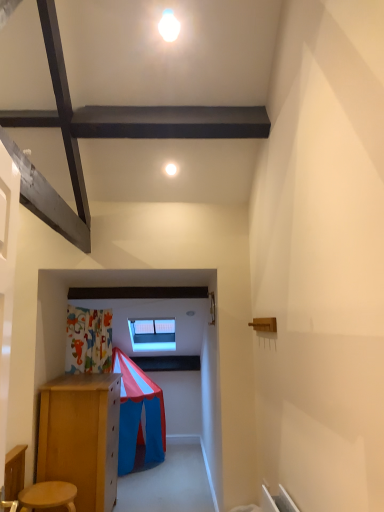
Question: From the image's perspective, is transparent glass window at center located above wooden stool at lower left?

Choices:
 (A) no
 (B) yes

Answer: (B)

Question: From a real-world perspective, is transparent glass window at center over wooden stool at lower left?

Choices:
 (A) yes
 (B) no

Answer: (A)

Question: Is transparent glass window at center surrounding wooden stool at lower left?

Choices:
 (A) yes
 (B) no

Answer: (B)

Question: Is transparent glass window at center positioned before wooden stool at lower left?

Choices:
 (A) yes
 (B) no

Answer: (B)

Question: Does transparent glass window at center appear on the right side of wooden stool at lower left?

Choices:
 (A) no
 (B) yes

Answer: (B)

Question: From their relative heights in the image, would you say wooden stool at lower left is taller or shorter than white glossy light at upper center?

Choices:
 (A) short
 (B) tall

Answer: (B)

Question: Is wooden stool at lower left in front of or behind white glossy light at upper center in the image?

Choices:
 (A) behind
 (B) front

Answer: (B)

Question: Is wooden stool at lower left inside or outside of white glossy light at upper center?

Choices:
 (A) outside
 (B) inside

Answer: (A)

Question: Is point (57, 486) positioned closer to the camera than point (173, 168)?

Choices:
 (A) farther
 (B) closer

Answer: (B)

Question: Considering the positions of white glossy light at upper center and wooden stool at lower left in the image, is white glossy light at upper center taller or shorter than wooden stool at lower left?

Choices:
 (A) tall
 (B) short

Answer: (B)

Question: In the image, is white glossy light at upper center on the left side or the right side of wooden stool at lower left?

Choices:
 (A) left
 (B) right

Answer: (B)

Question: Looking at the image, does white glossy light at upper center seem bigger or smaller compared to wooden stool at lower left?

Choices:
 (A) small
 (B) big

Answer: (A)

Question: Is white glossy light at upper center inside the boundaries of wooden stool at lower left, or outside?

Choices:
 (A) outside
 (B) inside

Answer: (A)

Question: Is wooden stool at lower left bigger or smaller than transparent glass window at center?

Choices:
 (A) big
 (B) small

Answer: (B)

Question: Choose the correct answer: Is wooden stool at lower left inside transparent glass window at center or outside it?

Choices:
 (A) inside
 (B) outside

Answer: (B)